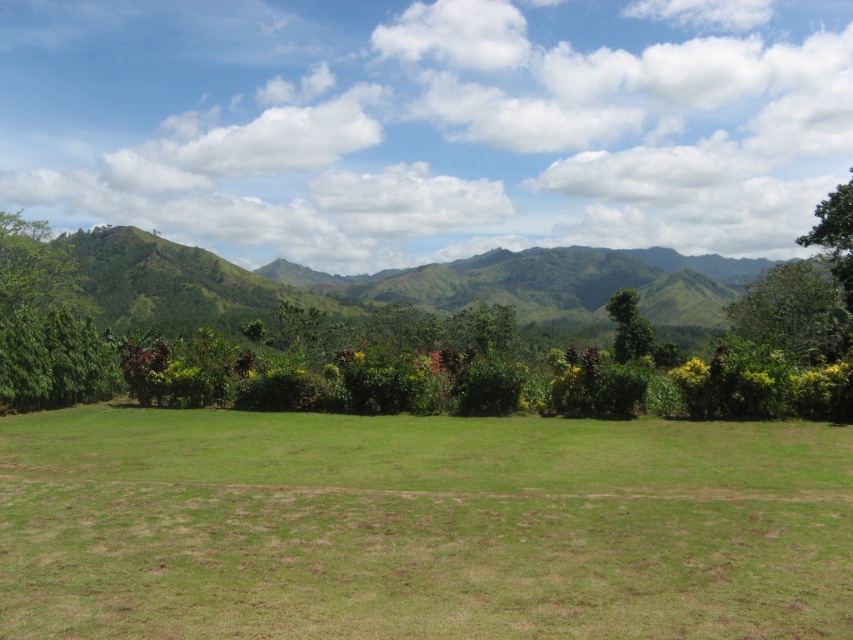
You are standing in the middle of the grassy field and want to walk towards the green leafy tree at right and the green leafy tree at center. Which tree will you reach first?

The green leafy tree at right is closer to the viewer than the green leafy tree at center, so you will reach the green leafy tree at right first.

You are standing at the camera position and want to walk to the green grass at center. Is the distance less than 25 feet?

The green grass at center is 24.96 feet away from camera, so yes, the distance is less than 25 feet.

You are planning to plant a new tree in this landscape. The new tree will grow to be as wide as the green leafy tree at upper right. If you want to ensure there is enough space between the new tree and the green leafy tree at left, where should you plant it?

You should plant the new tree on the side opposite to the green leafy tree at left, away from its current position, since the green leafy tree at left is narrower than the green leafy tree at upper right. This ensures sufficient space between the new tree and the existing narrower tree.